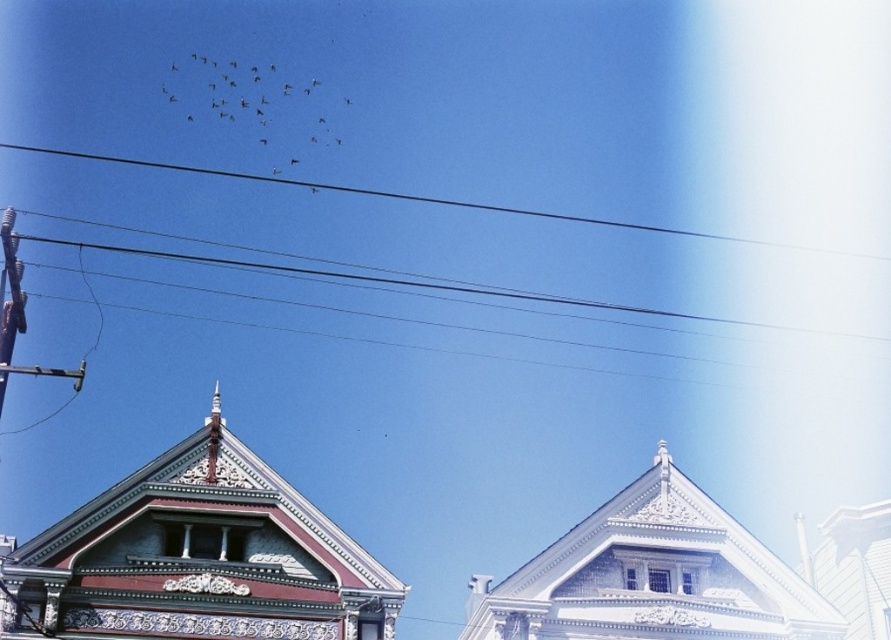
Question: Which of the following is the farthest from the observer?

Choices:
 (A) (296, 115)
 (B) (835, 252)

Answer: (B)

Question: Does dark gray feathers at upper center have a larger size compared to black wire at upper center?

Choices:
 (A) no
 (B) yes

Answer: (A)

Question: Does dark gray feathers at upper center appear under black wire at upper center?

Choices:
 (A) no
 (B) yes

Answer: (A)

Question: Is dark gray feathers at upper center smaller than black wire at upper center?

Choices:
 (A) yes
 (B) no

Answer: (A)